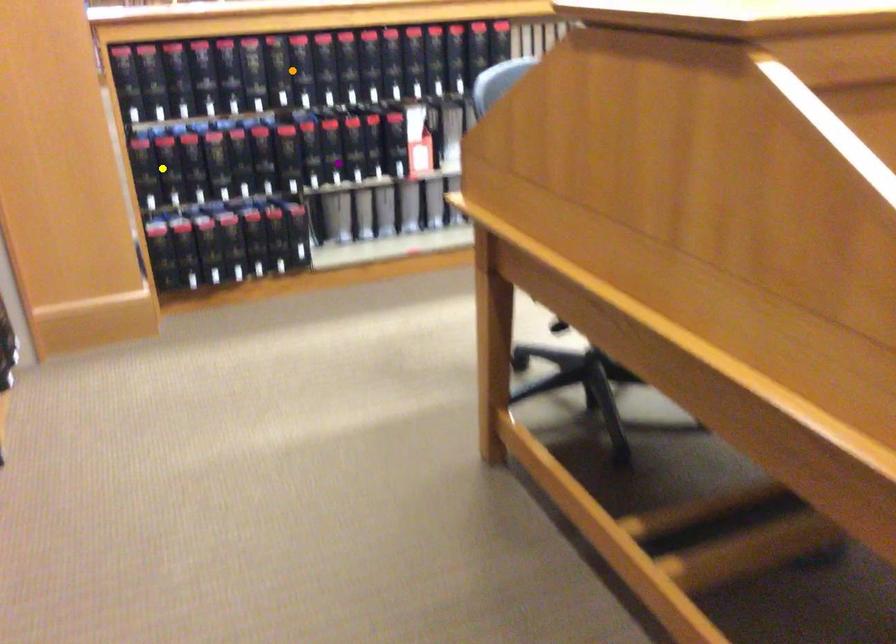
Order these from farthest to nearest:
purple point, orange point, yellow point

purple point
orange point
yellow point